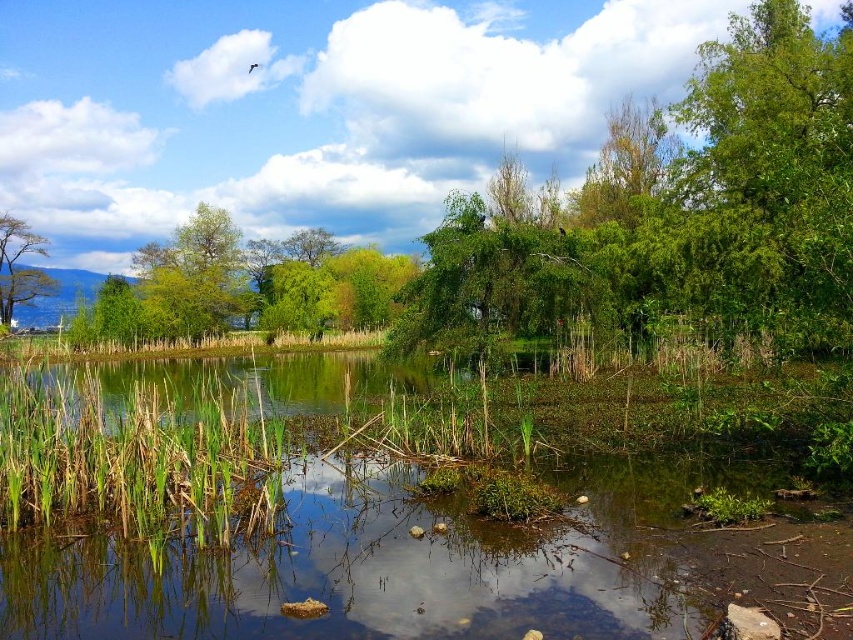
Question: Is green grassy reed at lower left smaller than smooth bark tree at upper left?

Choices:
 (A) no
 (B) yes

Answer: (B)

Question: Does green grassy reed at lower left have a larger size compared to smooth bark tree at upper left?

Choices:
 (A) no
 (B) yes

Answer: (A)

Question: Which point appears closest to the camera in this image?

Choices:
 (A) (86, 440)
 (B) (33, 285)

Answer: (A)

Question: Is green grassy reed at lower left positioned at the back of smooth bark tree at upper left?

Choices:
 (A) no
 (B) yes

Answer: (A)

Question: Which point is farther to the camera?

Choices:
 (A) (77, 426)
 (B) (9, 225)

Answer: (B)

Question: Among these points, which one is nearest to the camera?

Choices:
 (A) (149, 481)
 (B) (9, 323)

Answer: (A)